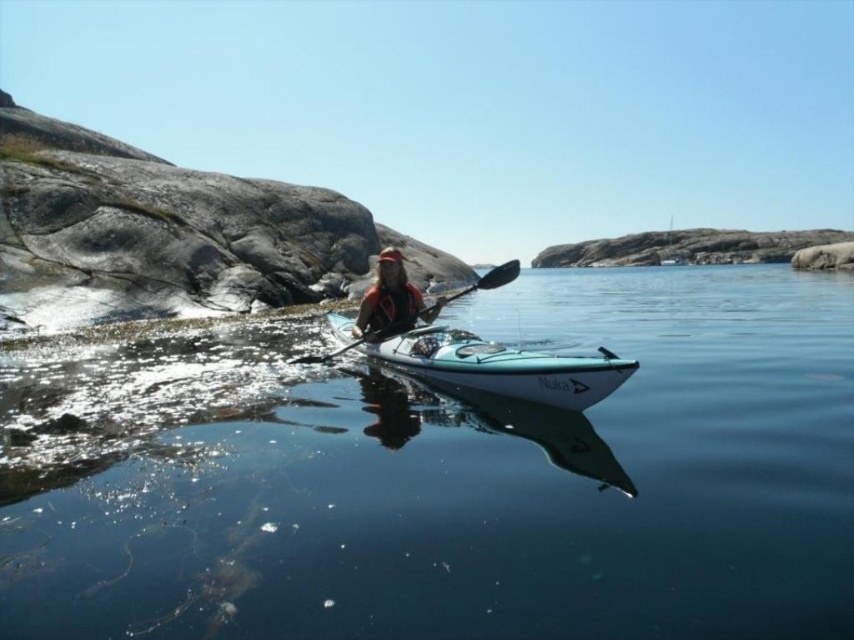
You are a safety inspector checking the kayaking setup. The clear blue water at center and the matte orange life vest at center are both visible. According to safety regulations, the life vest must be positioned above the water surface. Is the current arrangement compliant?

The clear blue water at center is located below the matte orange life vest at center, which means the life vest is positioned above the water surface. This arrangement complies with safety regulations.